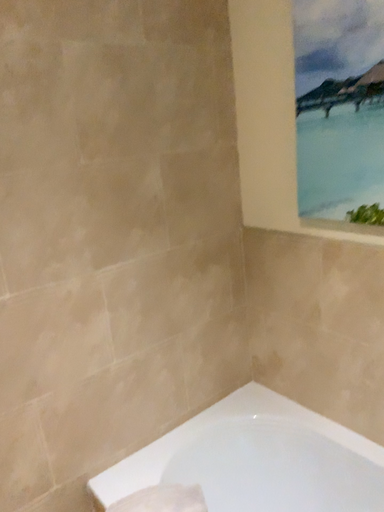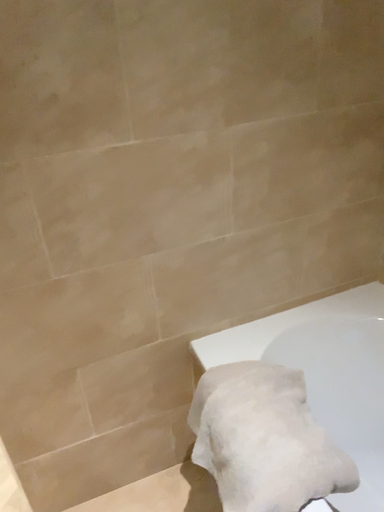
Question: How did the camera likely rotate when shooting the video?

Choices:
 (A) rotated downward
 (B) rotated upward

Answer: (A)